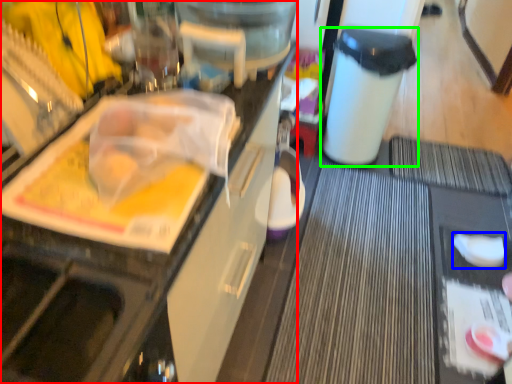
Question: Which is farther away from cabinetry (highlighted by a red box)? food (highlighted by a blue box) or trash bin/can (highlighted by a green box)?

Choices:
 (A) food
 (B) trash bin/can

Answer: (A)